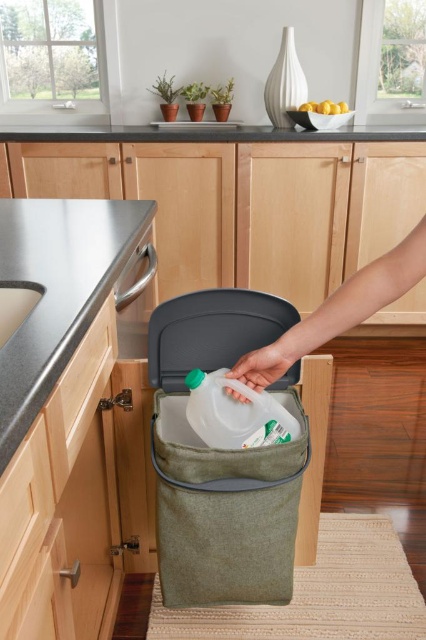
Question: Can you confirm if satin steel countertop at upper center is smaller than translucent plastic bottle at center?

Choices:
 (A) no
 (B) yes

Answer: (A)

Question: Which object is positioned closest to the satin steel countertop at upper center?

Choices:
 (A) stainless steel countertop at upper left
 (B) translucent plastic bottle at center

Answer: (A)

Question: Considering the real-world distances, which object is closest to the stainless steel countertop at upper left?

Choices:
 (A) satin steel countertop at upper center
 (B) translucent plastic bottle at center

Answer: (B)

Question: Is stainless steel countertop at upper left to the left of satin steel countertop at upper center from the viewer's perspective?

Choices:
 (A) no
 (B) yes

Answer: (B)

Question: Which object is the closest to the translucent plastic bottle at center?

Choices:
 (A) satin steel countertop at upper center
 (B) stainless steel countertop at upper left

Answer: (B)

Question: Observing the image, what is the correct spatial positioning of stainless steel countertop at upper left in reference to translucent plastic bottle at center?

Choices:
 (A) above
 (B) below

Answer: (A)